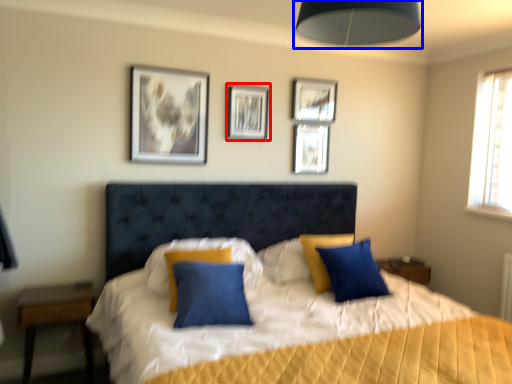
Question: Which of the following is the farthest to the observer, picture frame (highlighted by a red box) or lamp (highlighted by a blue box)?

Choices:
 (A) picture frame
 (B) lamp

Answer: (A)